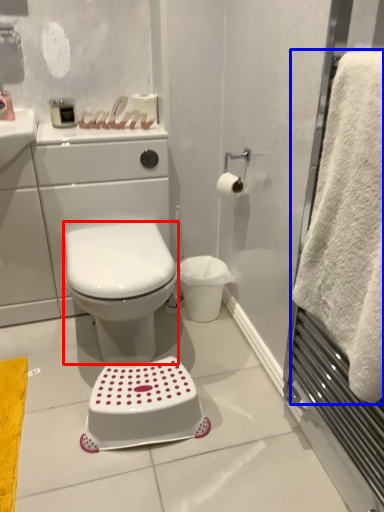
Question: Which object is further to the camera taking this photo, bidet (highlighted by a red box) or towel (highlighted by a blue box)?

Choices:
 (A) bidet
 (B) towel

Answer: (A)